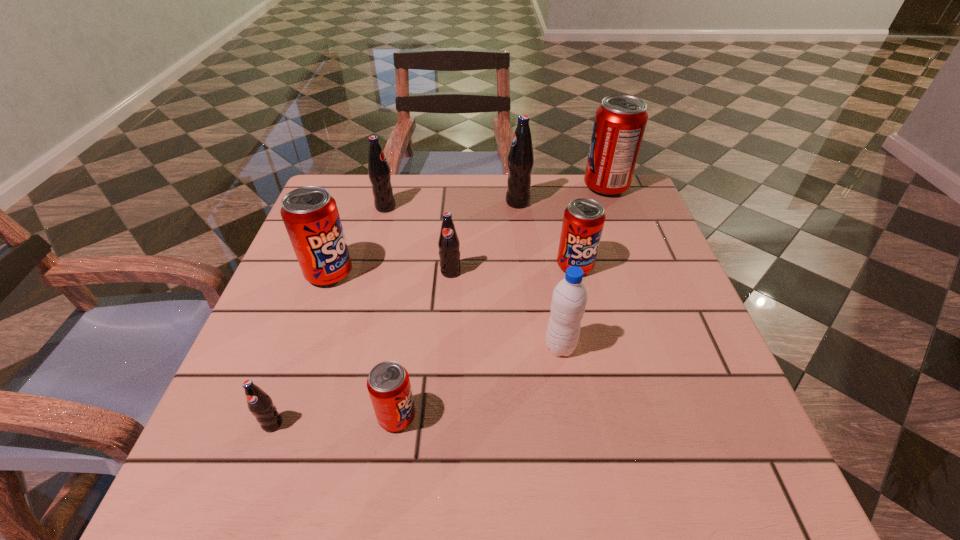
Locate which soda can is the fourth closest to the biggest red soda can. Please provide its 2D coordinates. Your answer should be formatted as a tuple, i.e. [(x, y)], where the tuple contains the x and y coordinates of a point satisfying the conditions above.

[(379, 173)]

This screenshot has width=960, height=540. Identify the location of red soda can that stands as the second closest to the water bottle. (388, 383).

Locate which red soda can ranks in proximity to the third red soda can from right to left. Please provide its 2D coordinates. Your answer should be formatted as a tuple, i.e. [(x, y)], where the tuple contains the x and y coordinates of a point satisfying the conditions above.

[(310, 215)]

Identify the location of the second closest black pop to the nearest red soda can. This screenshot has height=540, width=960. pyautogui.click(x=448, y=243).

Image resolution: width=960 pixels, height=540 pixels. What are the coordinates of `black pop that is the closest to the biggest black pop` in the screenshot? It's located at (448, 243).

At what (x,y) coordinates should I click in order to perform the action: click on blank area in the image that satisfies the following two spatial constraints: 1. on the front label of the rightmost black pop; 2. on the front label of the fifth soda can from left to right. Please return your answer as a coordinate pair (x, y). The image size is (960, 540). Looking at the image, I should click on (525, 272).

This screenshot has height=540, width=960. Identify the location of free region that satisfies the following two spatial constraints: 1. on the front label of the second black pop from left to right; 2. on the front side of the leftmost red soda can. (368, 273).

The image size is (960, 540). What are the coordinates of `vacant space that satisfies the following two spatial constraints: 1. on the front label of the third smallest black pop; 2. on the right side of the nearest red soda can` in the screenshot? It's located at (330, 416).